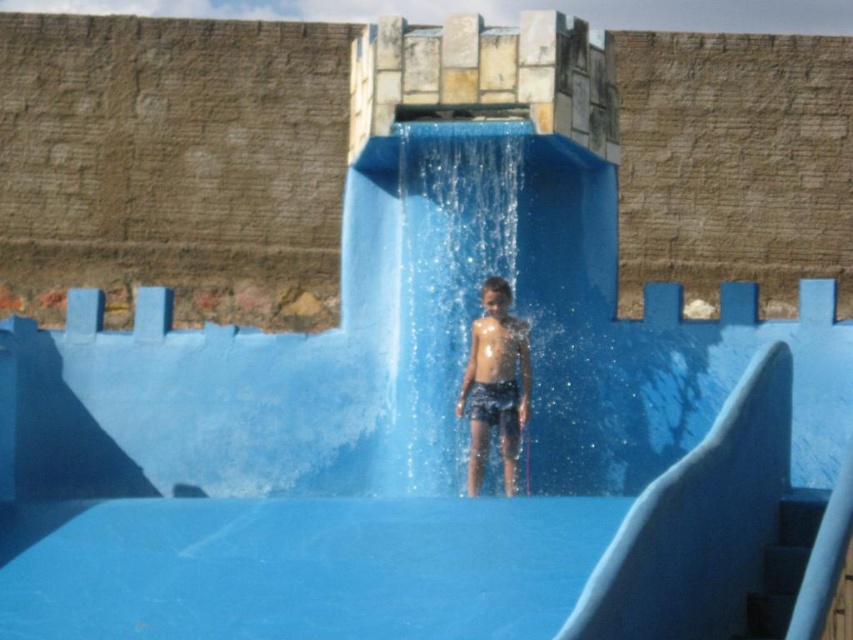
Question: Considering the real-world distances, which object is farthest from the shiny blue shorts at center?

Choices:
 (A) white glossy slide at center
 (B) shiny skin at center
 (C) clear water at center

Answer: (A)

Question: Is white glossy slide at center closer to the viewer compared to shiny blue shorts at center?

Choices:
 (A) no
 (B) yes

Answer: (B)

Question: Which of the following is the farthest from the observer?

Choices:
 (A) clear water at center
 (B) shiny skin at center
 (C) white glossy slide at center

Answer: (B)

Question: Based on their relative distances, which object is farther from the shiny blue shorts at center?

Choices:
 (A) white glossy slide at center
 (B) clear water at center

Answer: (A)

Question: Is clear water at center above white glossy slide at center?

Choices:
 (A) no
 (B) yes

Answer: (B)

Question: Does shiny blue shorts at center have a larger size compared to shiny skin at center?

Choices:
 (A) no
 (B) yes

Answer: (A)